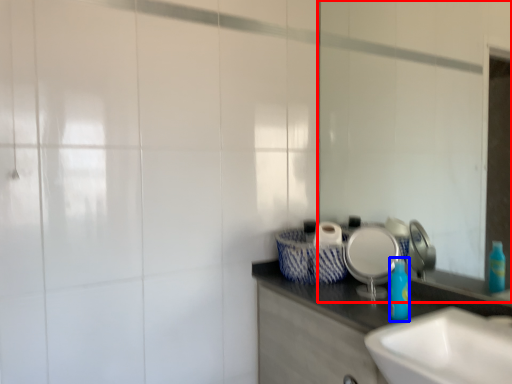
Question: Which object appears farthest to the camera in this image, mirror (highlighted by a red box) or bottle (highlighted by a blue box)?

Choices:
 (A) mirror
 (B) bottle

Answer: (B)